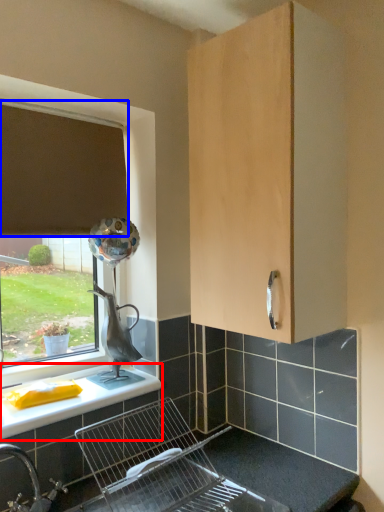
Question: Which of the following is the closest to the observer, countertop (highlighted by a red box) or curtain (highlighted by a blue box)?

Choices:
 (A) countertop
 (B) curtain

Answer: (A)